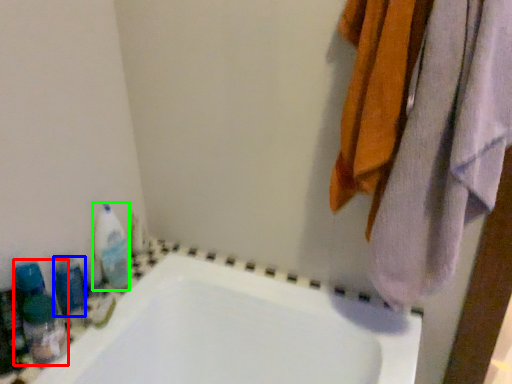
Question: Which object is positioned closest to cleaning product (highlighted by a red box)? Select from toiletry (highlighted by a blue box) and cleaning product (highlighted by a green box).

Choices:
 (A) toiletry
 (B) cleaning product

Answer: (A)